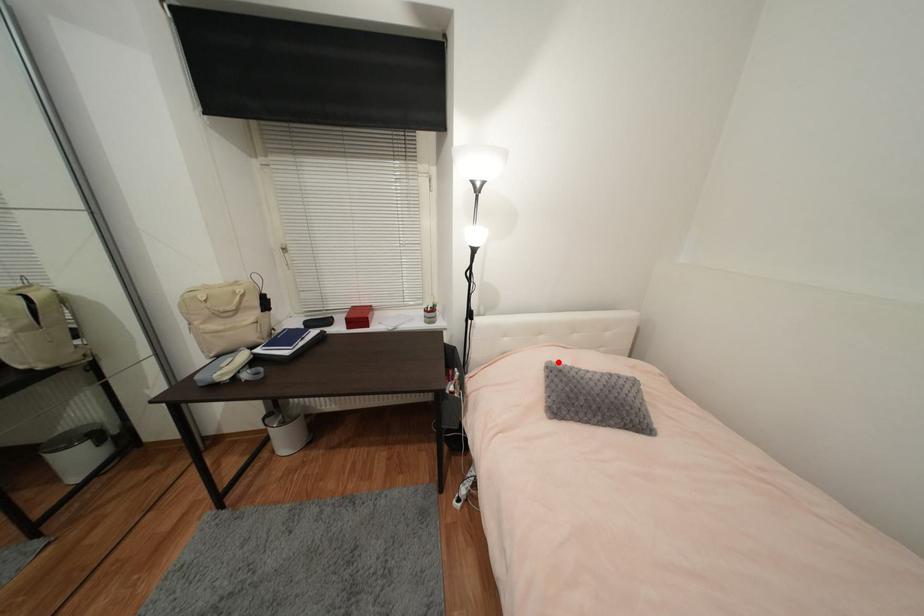
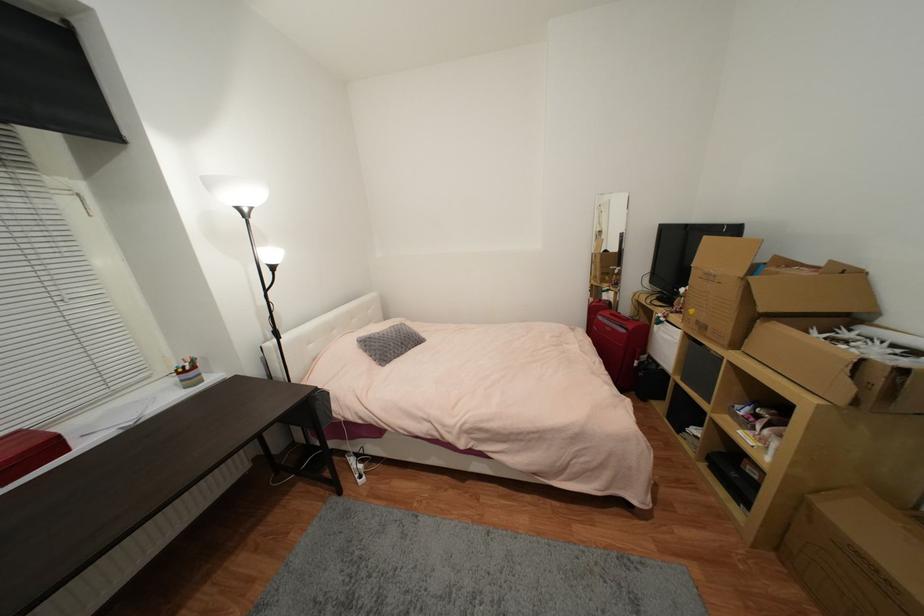
Where in the second image is the point corresponding to the highlighted location from the first image?

(365, 338)